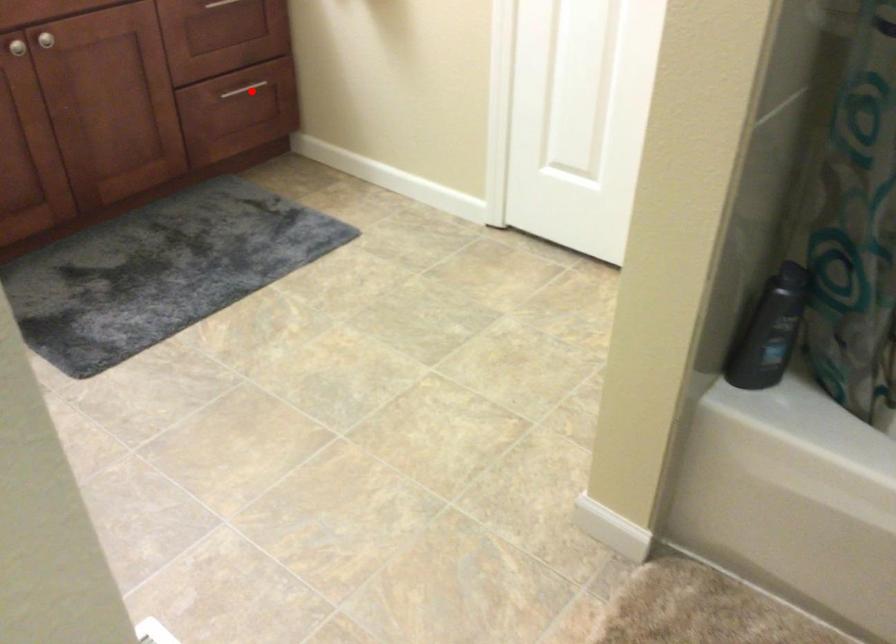
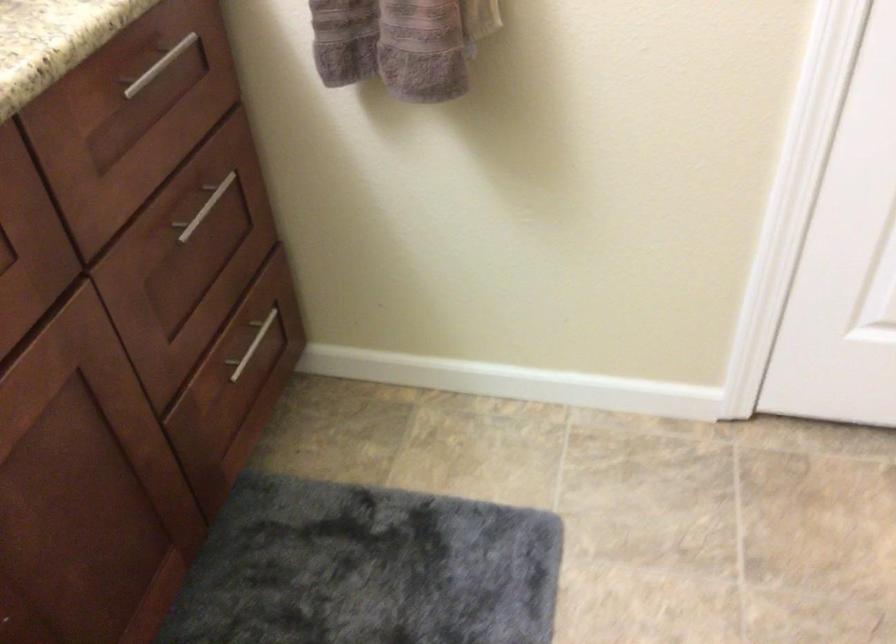
Question: I am providing you with two images of the same scene from different viewpoints. In image1, a red point is highlighted. Considering the same 3D point in image2, which of the following is correct?

Choices:
 (A) It is closer
 (B) It is farther

Answer: (A)